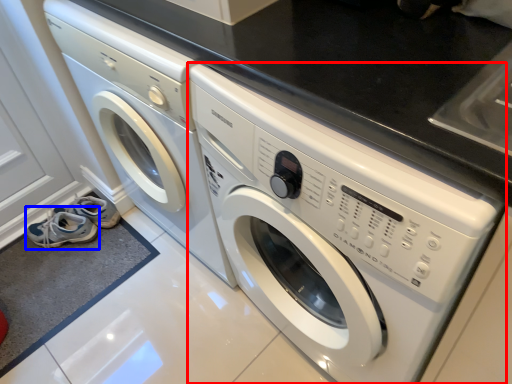
Question: Which object appears farthest to the camera in this image, washing machine (highlighted by a red box) or shoe (highlighted by a blue box)?

Choices:
 (A) washing machine
 (B) shoe

Answer: (B)